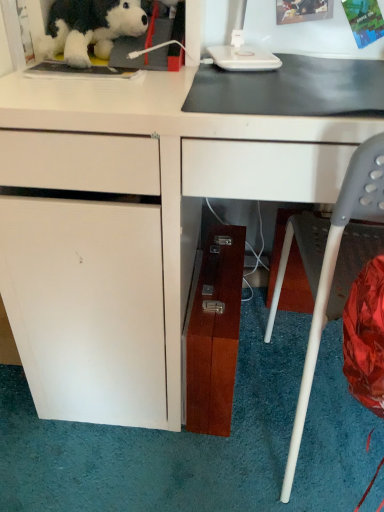
You are a GUI agent. You are given a task and a screenshot of the screen. Output one action in this format:
    pyautogui.click(x=<x>, y=<y>)
    Task: Click on the vacant area on top of wooden file cabinet at lower center (from a real-world perspective)
    
    Given the screenshot: What is the action you would take?
    pyautogui.click(x=220, y=270)